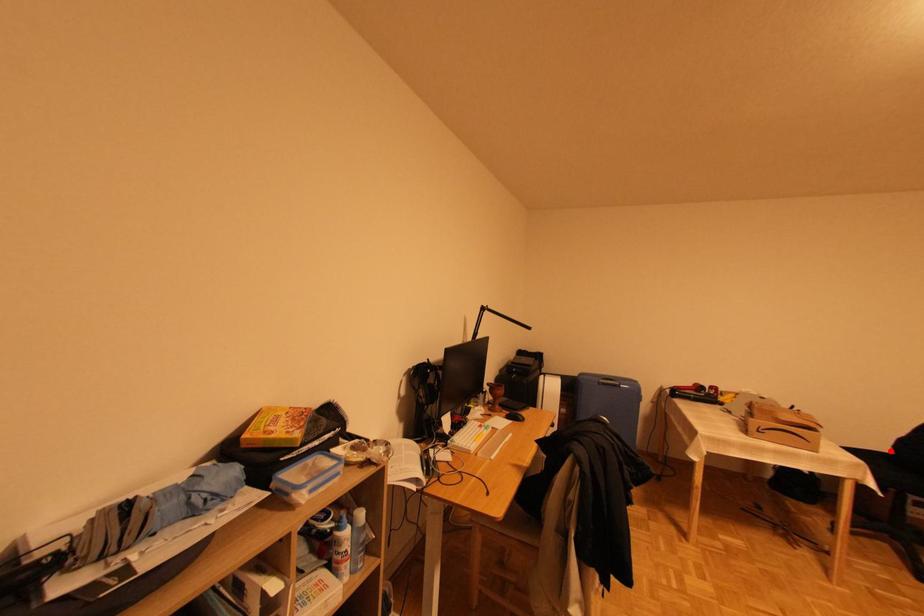
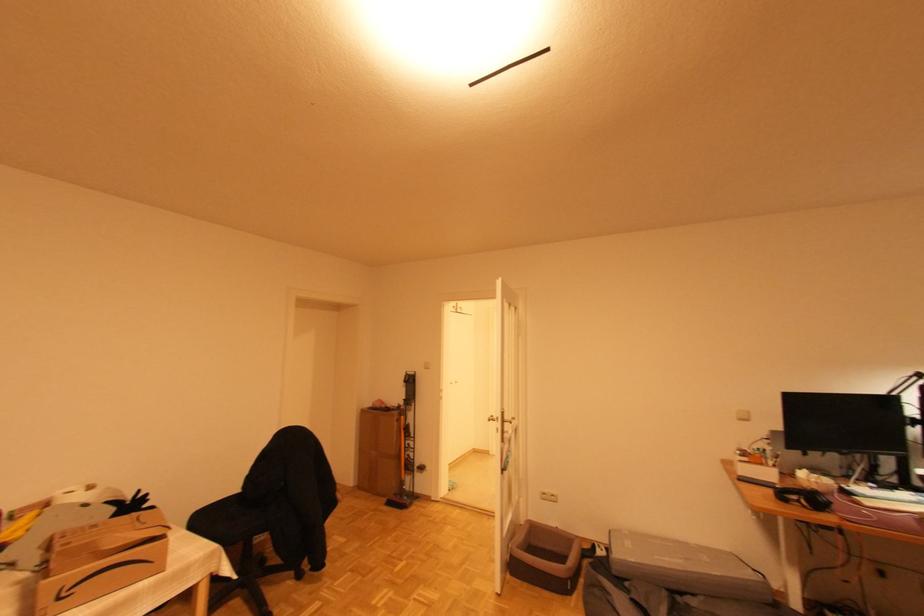
Find the pixel in the second image that matches the highlighted location in the first image.

(239, 493)